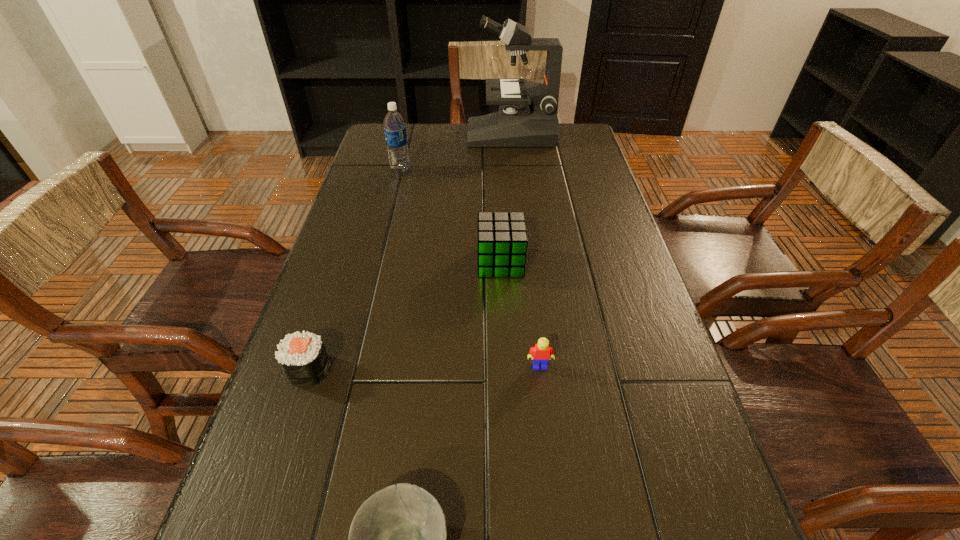
Where is `blank space at the far edge of the desktop`? The height and width of the screenshot is (540, 960). blank space at the far edge of the desktop is located at coordinates point(448,143).

This screenshot has height=540, width=960. Identify the location of free region at the left edge of the desktop. (366, 312).

In the image, there is a desktop. In order to click on vacant space at the right edge in this screenshot , I will do `click(571, 270)`.

Where is `vacant space at the far left corner`? Image resolution: width=960 pixels, height=540 pixels. vacant space at the far left corner is located at coordinates (383, 140).

Image resolution: width=960 pixels, height=540 pixels. In order to click on vacant point at the far right corner in this screenshot , I will do `click(564, 153)`.

Find the location of `vacant point located between the leftmost object and the Lego`. vacant point located between the leftmost object and the Lego is located at coordinates (424, 368).

This screenshot has width=960, height=540. In order to click on vacant space that's between the cube and the leftmost object in this screenshot , I will do `click(404, 316)`.

Where is `free space between the leftmost object and the fifth shortest object`? free space between the leftmost object and the fifth shortest object is located at coordinates (355, 271).

You are a GUI agent. You are given a task and a screenshot of the screen. Output one action in this format:
    pyautogui.click(x=<x>, y=<y>)
    Task: Click on the unoccupied area between the water bottle and the Lego
    The image size is (960, 540).
    Given the screenshot: What is the action you would take?
    pyautogui.click(x=470, y=268)

You are a GUI agent. You are given a task and a screenshot of the screen. Output one action in this format:
    pyautogui.click(x=<x>, y=<y>)
    Task: Click on the unoccupied position between the cube and the fifth nearest object
    The width and height of the screenshot is (960, 540).
    Given the screenshot: What is the action you would take?
    pyautogui.click(x=450, y=217)